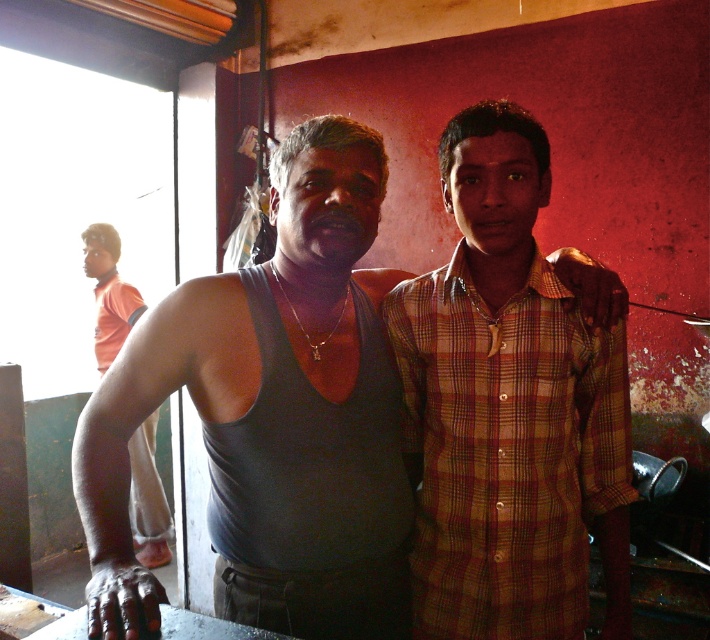
Who is lower down, dark gray tank top at center or orange fabric shirt at left?

orange fabric shirt at left

From the picture: Does dark gray tank top at center have a lesser height compared to orange fabric shirt at left?

No, dark gray tank top at center is not shorter than orange fabric shirt at left.

In order to click on dark gray tank top at center in this screenshot , I will do `click(273, 417)`.

Which is more to the left, plaid shirt at center or orange fabric shirt at left?

orange fabric shirt at left is more to the left.

Measure the distance from plaid shirt at center to orange fabric shirt at left.

plaid shirt at center and orange fabric shirt at left are 2.47 meters apart from each other.

Locate an element on the screen. This screenshot has width=710, height=640. plaid shirt at center is located at coordinates (507, 449).

Locate an element on the screen. The height and width of the screenshot is (640, 710). plaid shirt at center is located at coordinates (507, 449).

Between dark gray tank top at center and gray matte tank top at center, which one has less height?

gray matte tank top at center

Between dark gray tank top at center and gray matte tank top at center, which one has more height?

Standing taller between the two is dark gray tank top at center.

The height and width of the screenshot is (640, 710). What do you see at coordinates (273, 417) in the screenshot?
I see `dark gray tank top at center` at bounding box center [273, 417].

Image resolution: width=710 pixels, height=640 pixels. Identify the location of dark gray tank top at center. (273, 417).